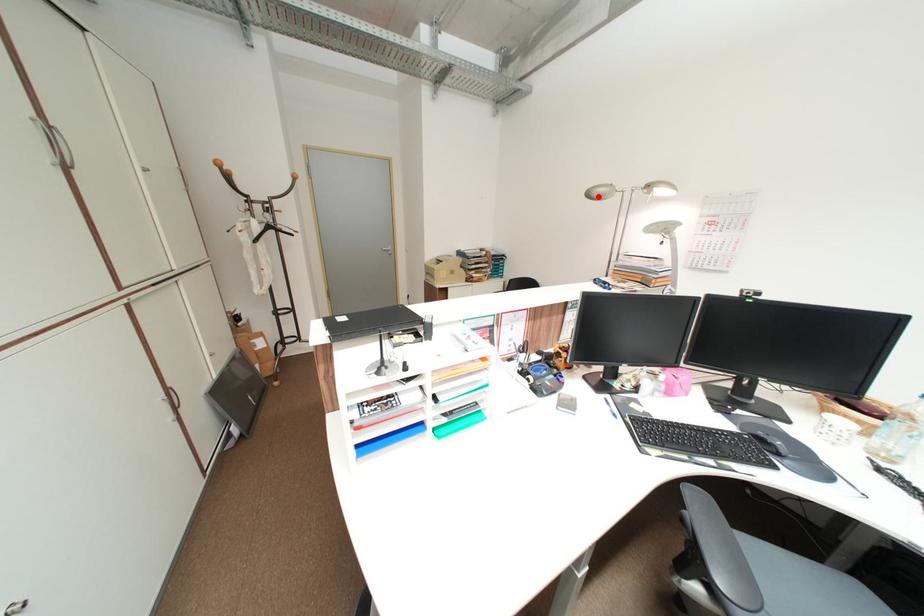
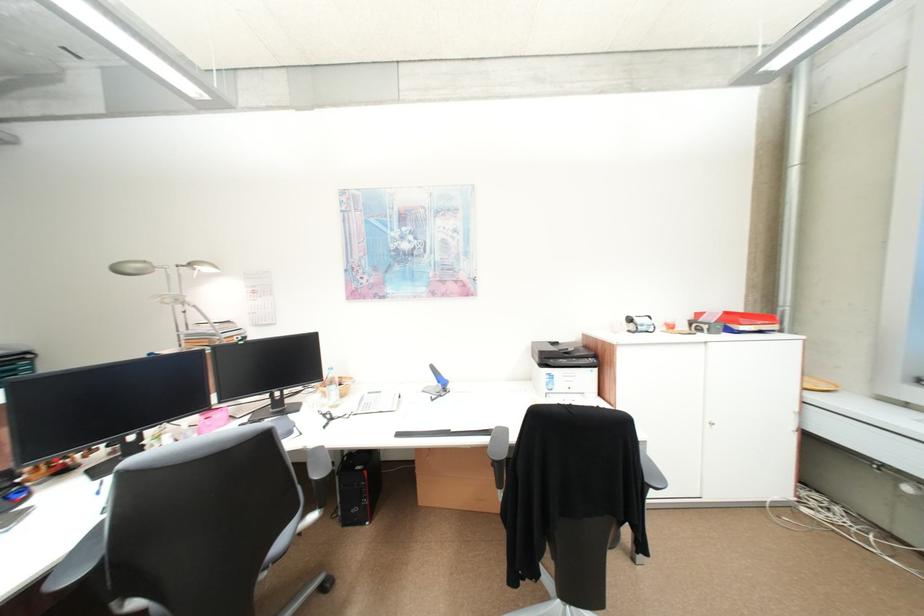
Locate, in the second image, the point that corresponds to the highlighted location in the first image.

(127, 272)